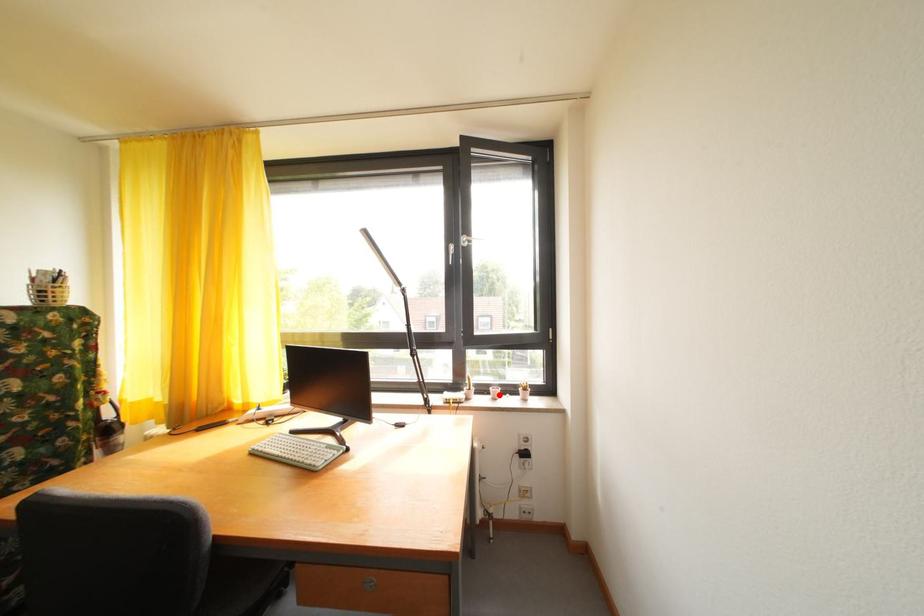
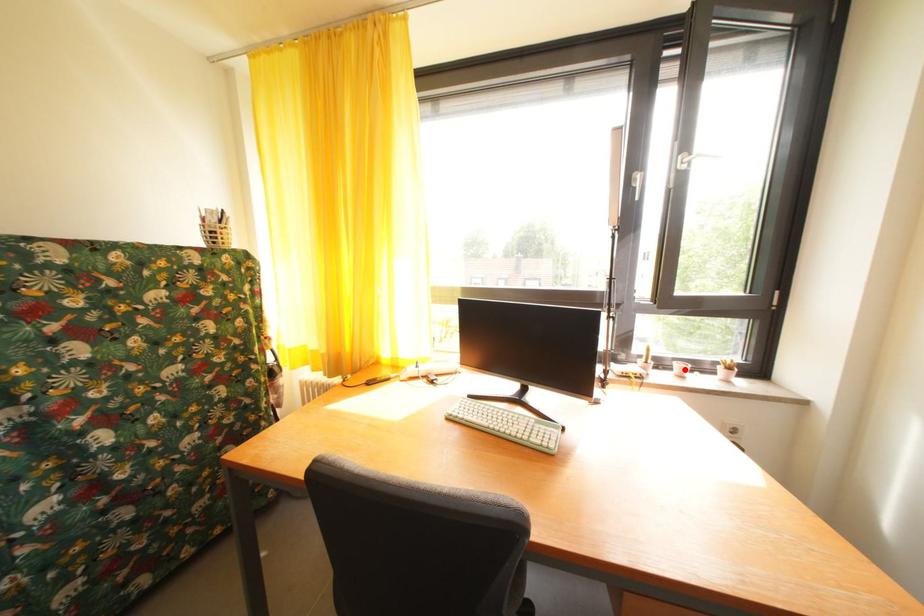
I am providing you with two images of the same scene from different viewpoints. A red point is marked on the first image and another point is marked on the second image. Is the red point in image1 aligned with the point shown in image2?

Yes